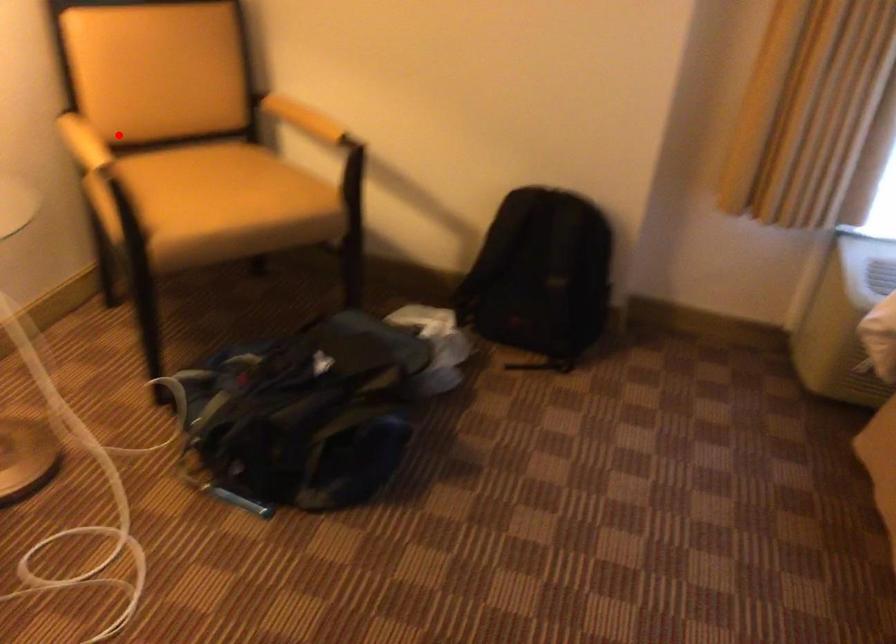
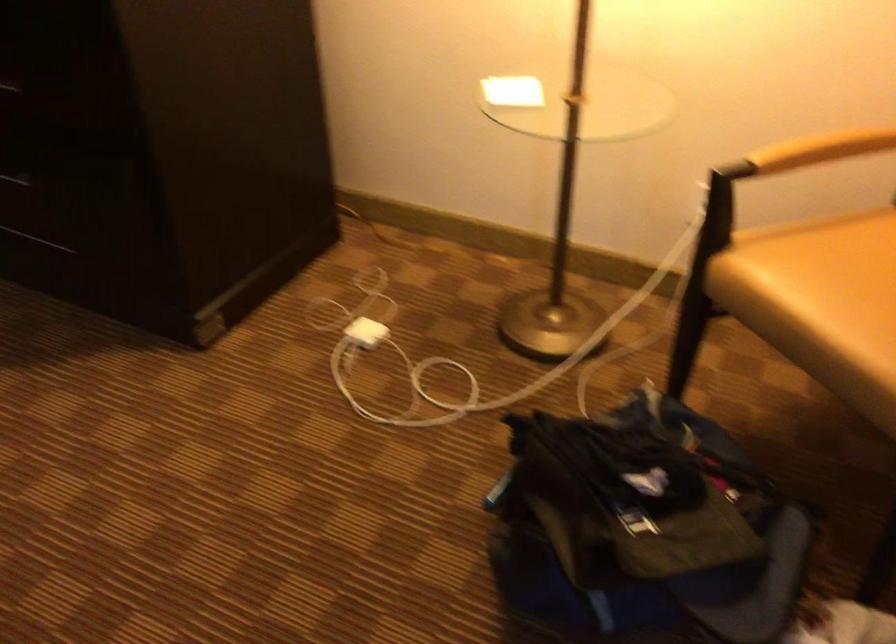
Locate, in the second image, the point that corresponds to the highlighted location in the first image.

(821, 149)